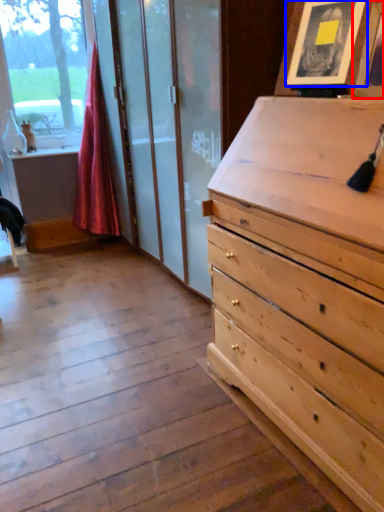
Question: Which of the following is the farthest to the observer, picture frame (highlighted by a red box) or picture frame (highlighted by a blue box)?

Choices:
 (A) picture frame
 (B) picture frame

Answer: (B)